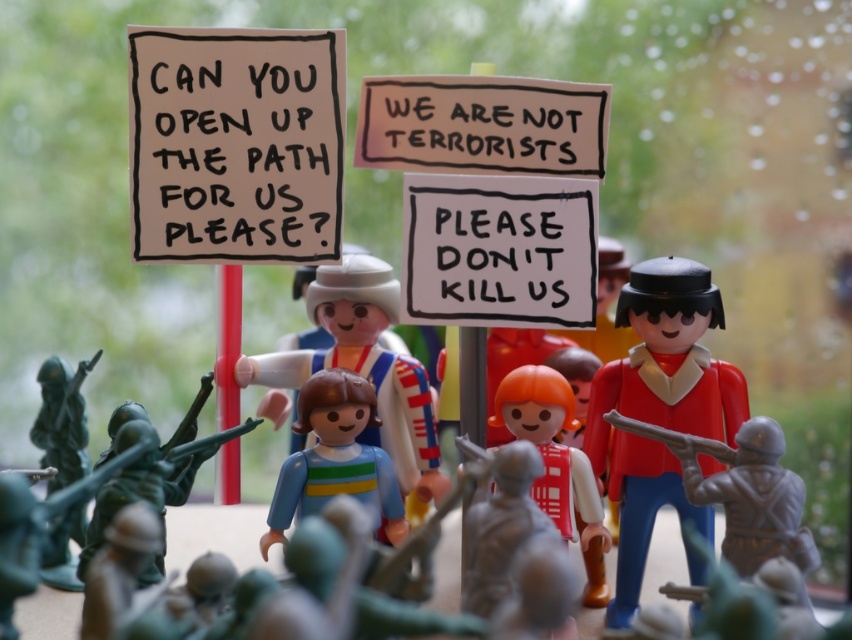
Does red plastic figure at center have a lesser width compared to brown cardboard sign at center?

Yes, red plastic figure at center is thinner than brown cardboard sign at center.

Which is in front, point (741, 420) or point (563, 92)?

Point (563, 92)

This screenshot has width=852, height=640. Identify the location of red plastic figure at center. (659, 406).

Which is in front, point (262, 157) or point (533, 481)?

Positioned in front is point (533, 481).

Measure the distance between point [211,156] and camera.

Point [211,156] is 1.25 meters away from camera.

Where is `white paper sign at upper left`? This screenshot has width=852, height=640. white paper sign at upper left is located at coordinates (235, 144).

At what (x,y) coordinates should I click in order to perform the action: click on white paper sign at upper left. Please return your answer as a coordinate pair (x, y). Looking at the image, I should click on (235, 144).

Can you confirm if white paper sign at upper left is positioned to the right of brown cardboard sign at center?

Incorrect, white paper sign at upper left is not on the right side of brown cardboard sign at center.

Identify the location of white paper sign at upper left. (235, 144).